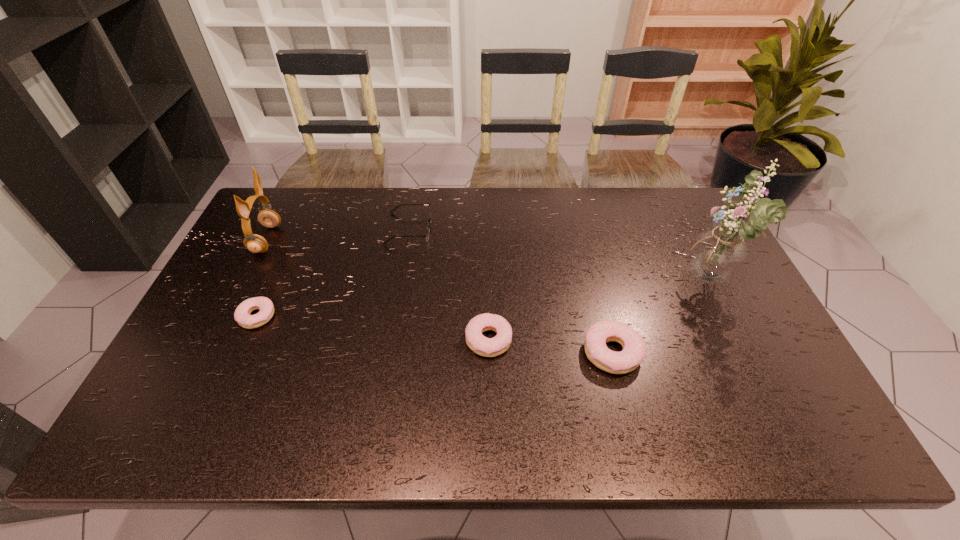
You are a GUI agent. You are given a task and a screenshot of the screen. Output one action in this format:
    pyautogui.click(x=<x>, y=<y>)
    Task: Click on the shortest doughnut
    Image resolution: width=960 pixels, height=540 pixels.
    Given the screenshot: What is the action you would take?
    pyautogui.click(x=242, y=315)

This screenshot has height=540, width=960. What are the coordinates of `the shortest object` in the screenshot? It's located at (242, 315).

Find the location of `the second shortest doughnut`. the second shortest doughnut is located at coordinates (488, 347).

Locate an element on the screen. the third object from right to left is located at coordinates (488, 347).

Find the location of a particular element. Image resolution: width=960 pixels, height=540 pixels. the tallest doughnut is located at coordinates (634, 348).

Image resolution: width=960 pixels, height=540 pixels. I want to click on the fifth object from left to right, so click(634, 348).

At what (x,y) coordinates should I click in order to perform the action: click on spectacles. Please return your answer as a coordinate pair (x, y). This screenshot has width=960, height=540. Looking at the image, I should click on (428, 227).

Locate an element on the screen. bouquet is located at coordinates (717, 254).

Where is `the rightmost object`? The image size is (960, 540). the rightmost object is located at coordinates (717, 254).

I want to click on earphone, so click(x=254, y=243).